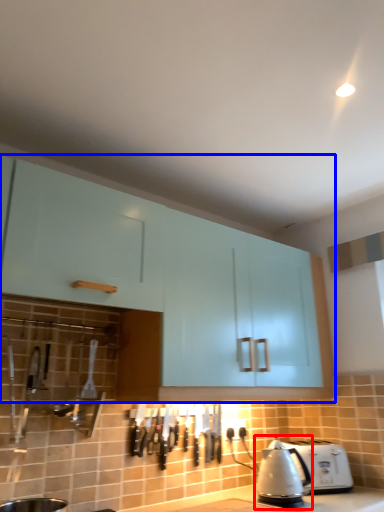
Question: Among these objects, which one is farthest to the camera, kettle (highlighted by a red box) or cabinetry (highlighted by a blue box)?

Choices:
 (A) kettle
 (B) cabinetry

Answer: (A)